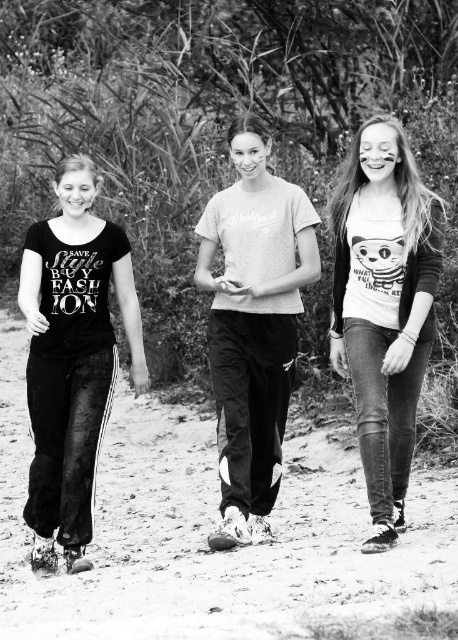
You are taking a photo of two points in the scene. The first point is at coordinates point [290,566] and the second is at point [272,480]. Which point is closer to the camera?

Point [290,566] is closer to the camera than point [272,480] according to the description.